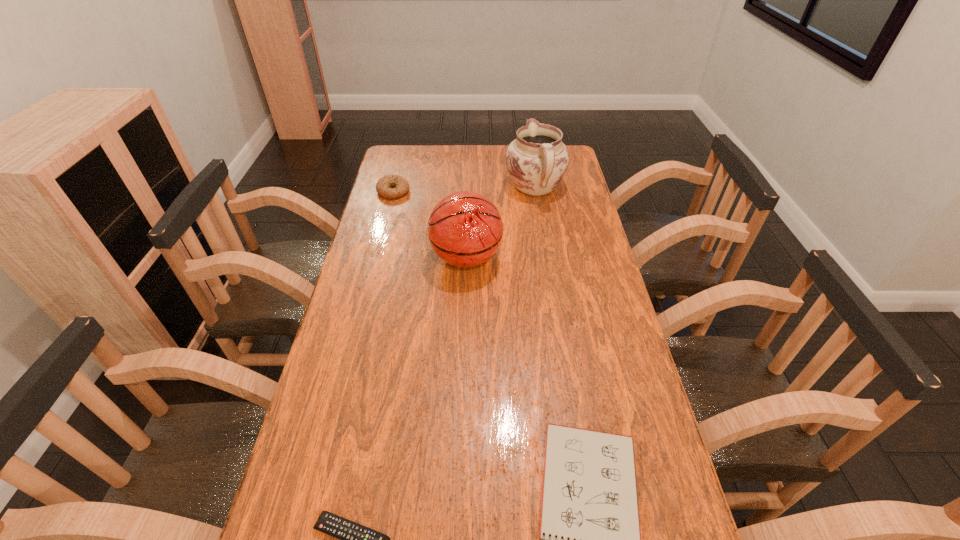
I want to click on pitcher, so click(x=537, y=160).

Identify the location of basketball. (465, 229).

Image resolution: width=960 pixels, height=540 pixels. Find the location of `the third farthest object`. the third farthest object is located at coordinates (465, 229).

Where is `the third shortest object`? the third shortest object is located at coordinates (383, 185).

Find the location of a particular element. vacant space situated 0.050m on the spout of the pitcher is located at coordinates point(531,163).

The image size is (960, 540). Identify the location of vacant space located on the spout of the pitcher. (530, 156).

I want to click on free space located on the spout of the pitcher, so click(x=529, y=150).

At what (x,y) coordinates should I click in order to perform the action: click on free space located on the side with spill of the third nearest object. Please return your answer as a coordinate pair (x, y). Looking at the image, I should click on (523, 258).

At what (x,y) coordinates should I click in order to perform the action: click on free space located 0.160m on the back of the third tallest object. Please return your answer as a coordinate pair (x, y). Looking at the image, I should click on (400, 161).

The width and height of the screenshot is (960, 540). Identify the location of object present at the far edge. [537, 160].